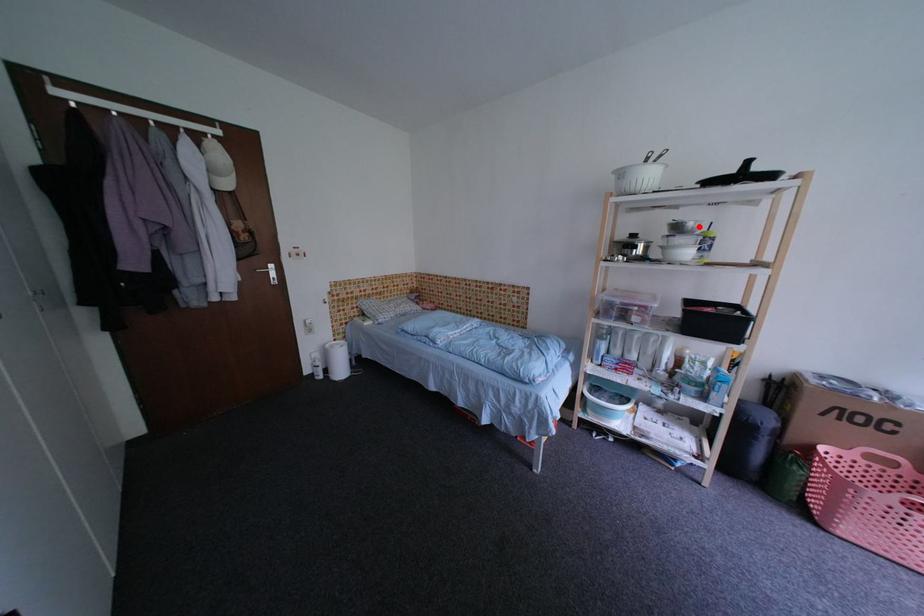
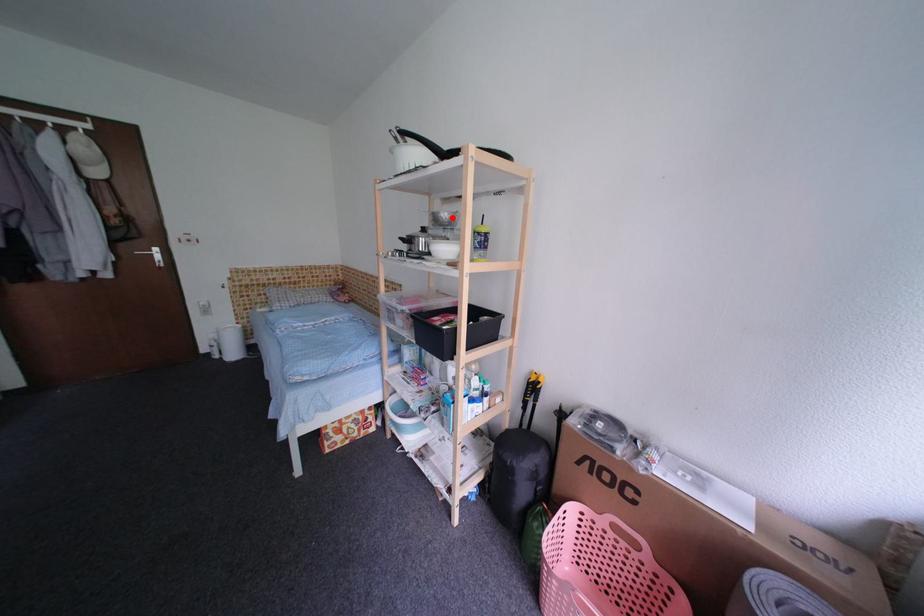
I am providing you with two images of the same scene from different viewpoints. A red point is marked on the first image and another point is marked on the second image. Do the highlighted points in image1 and image2 indicate the same real-world spot?

Yes